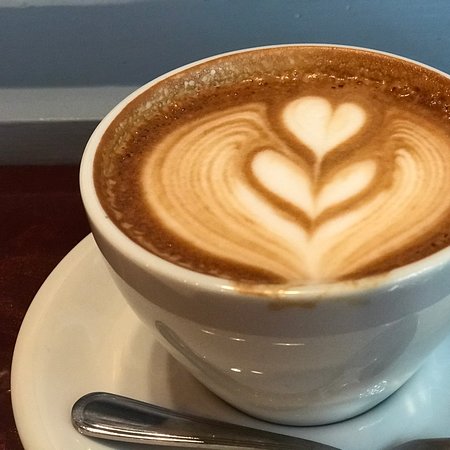
At what (x,y) coordinates should I click in order to perform the action: click on round, white plate. Please return your answer as a coordinate pair (x, y). The image size is (450, 450). Looking at the image, I should click on (113, 356).